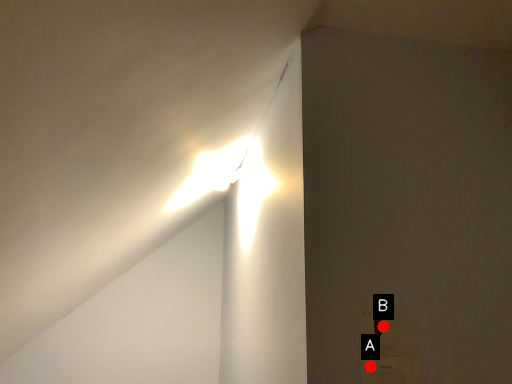
Question: Two points are circled on the image, labeled by A and B beside each circle. Which point is further to the camera?

Choices:
 (A) A is further
 (B) B is further

Answer: (B)